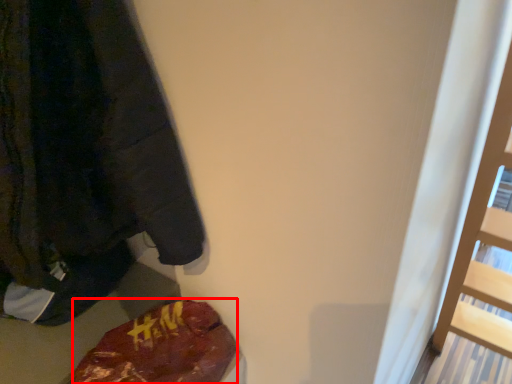
Question: From the image's perspective, what is the correct spatial positioning of food (annotated by the red box) in reference to sweatshirt?

Choices:
 (A) above
 (B) below

Answer: (B)